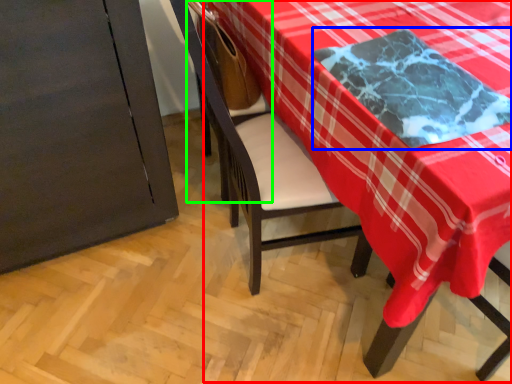
Question: Which object is the closest to the table (highlighted by a red box)? Choose among these: cloth (highlighted by a blue box) or armchair (highlighted by a green box).

Choices:
 (A) cloth
 (B) armchair

Answer: (A)